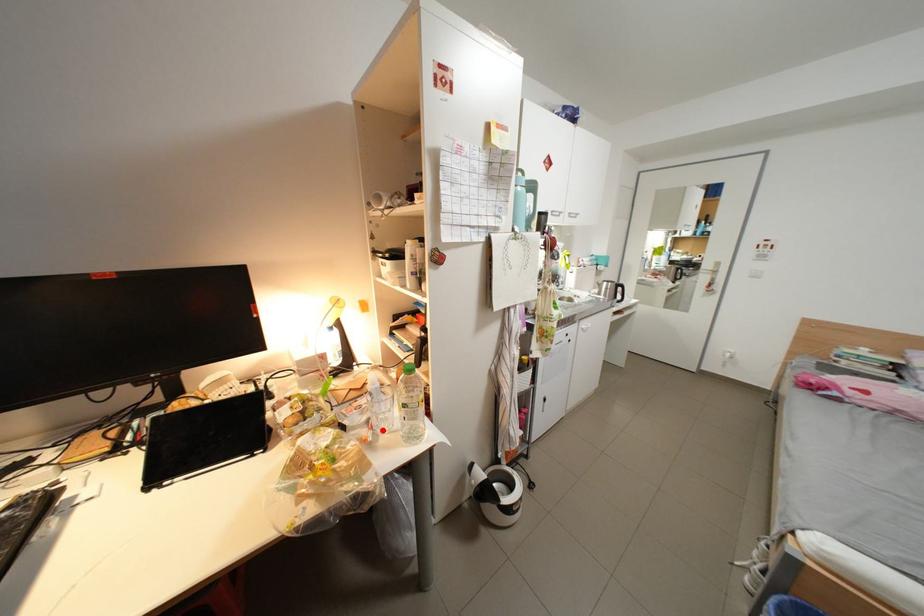
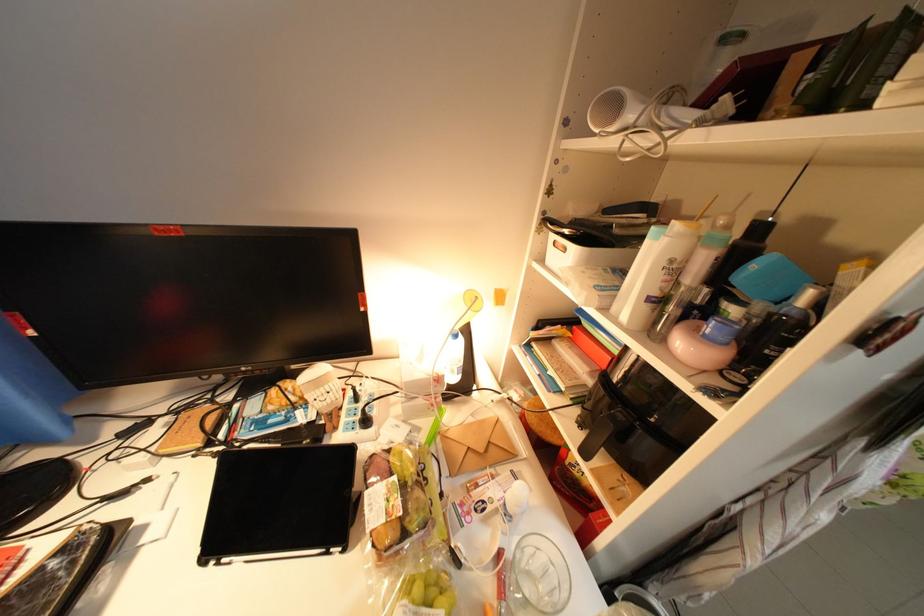
In the second image, find the point that corresponds to the highlighted location in the first image.

(514, 591)